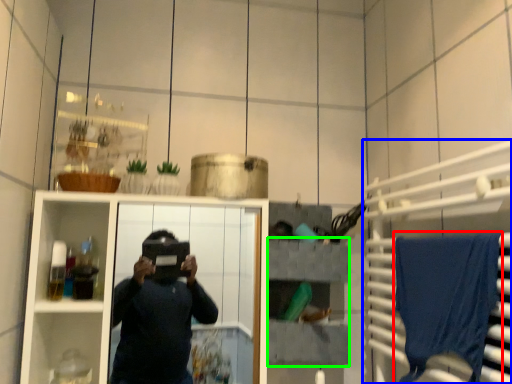
Question: Estimate the real-world distances between objects in this image. Which object is closer to bath towel (highlighted by a red box), cabinet (highlighted by a blue box) or shelf (highlighted by a green box)?

Choices:
 (A) cabinet
 (B) shelf

Answer: (A)